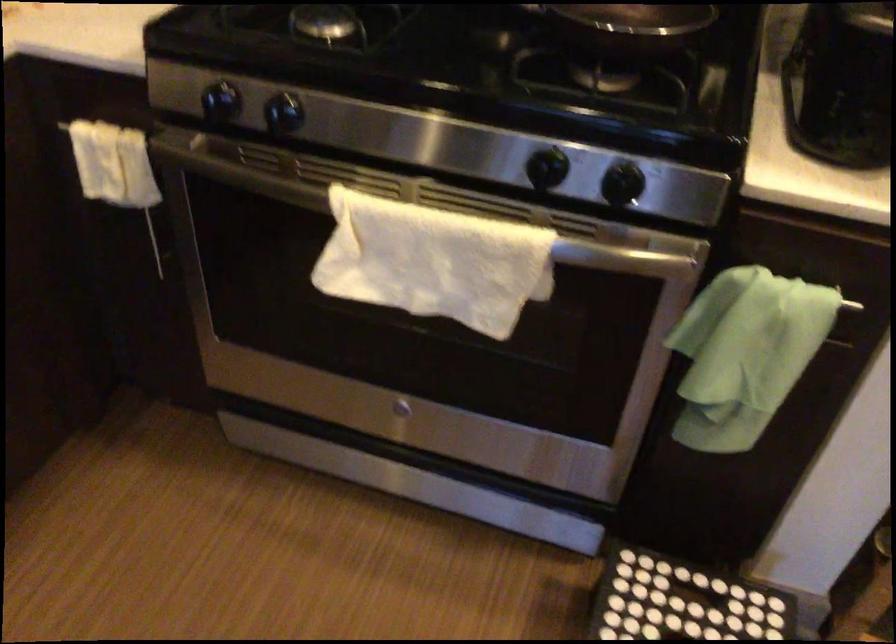
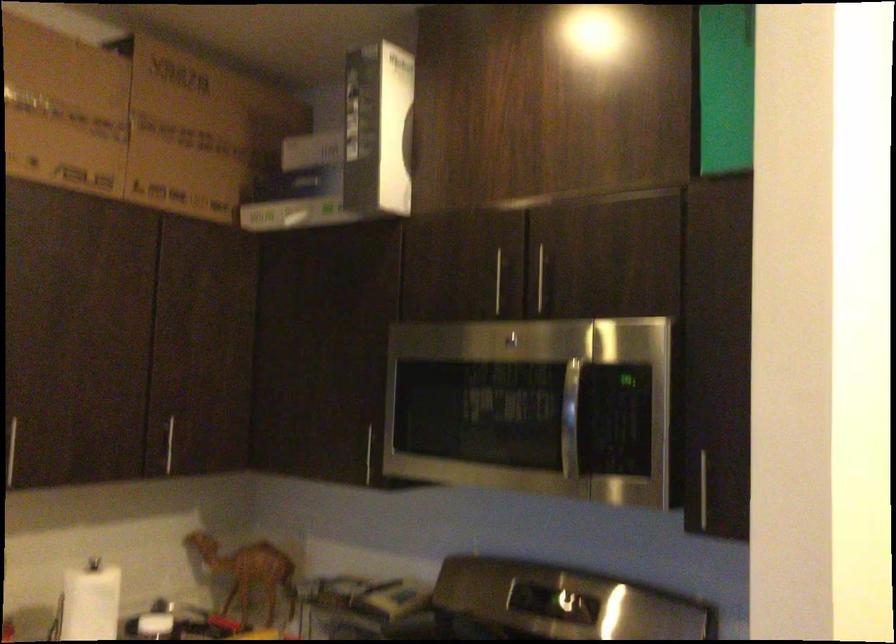
The images are taken continuously from a first-person perspective. In which direction is your viewpoint rotating?

The camera's rotation is toward left-up.